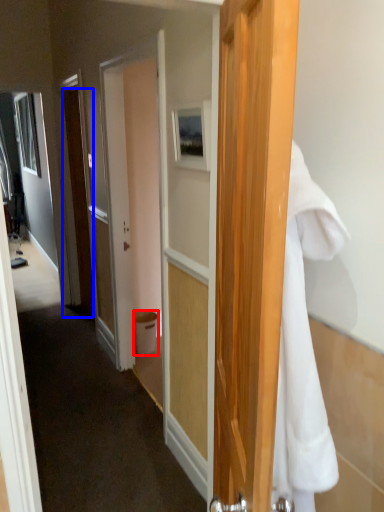
Question: Which point is further to the camera, trash bin/can (highlighted by a red box) or door (highlighted by a blue box)?

Choices:
 (A) trash bin/can
 (B) door

Answer: (A)